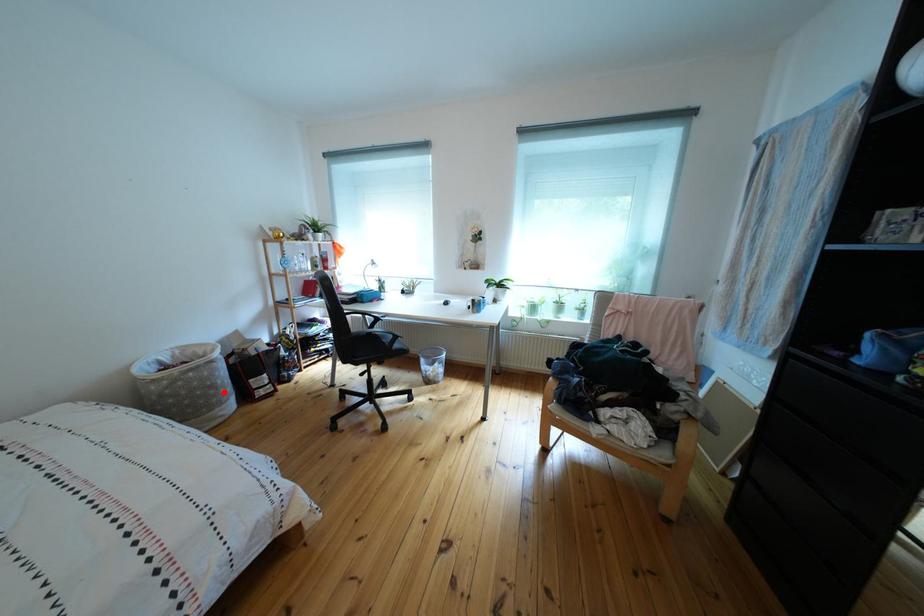
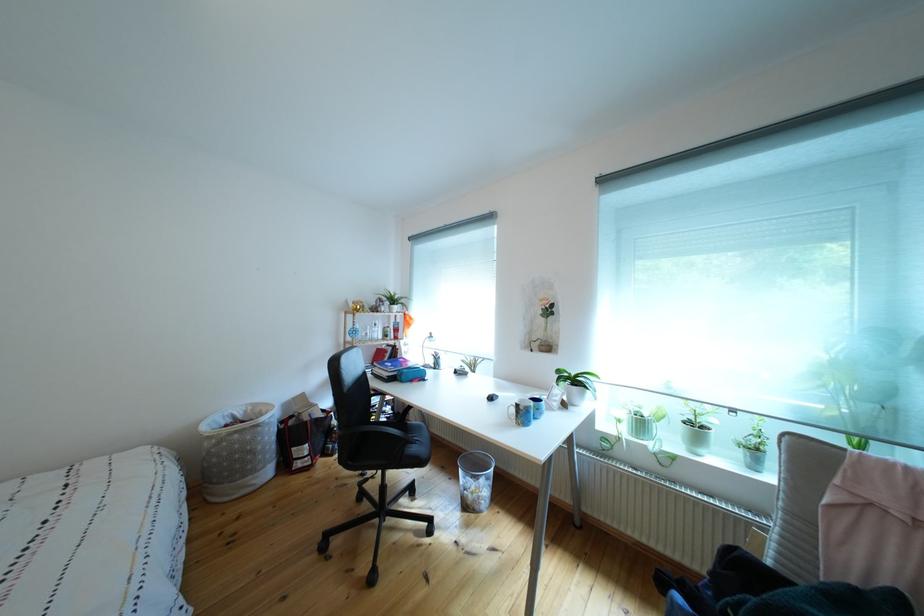
The point at the highlighted location is marked in the first image. Where is the corresponding point in the second image?

(263, 456)